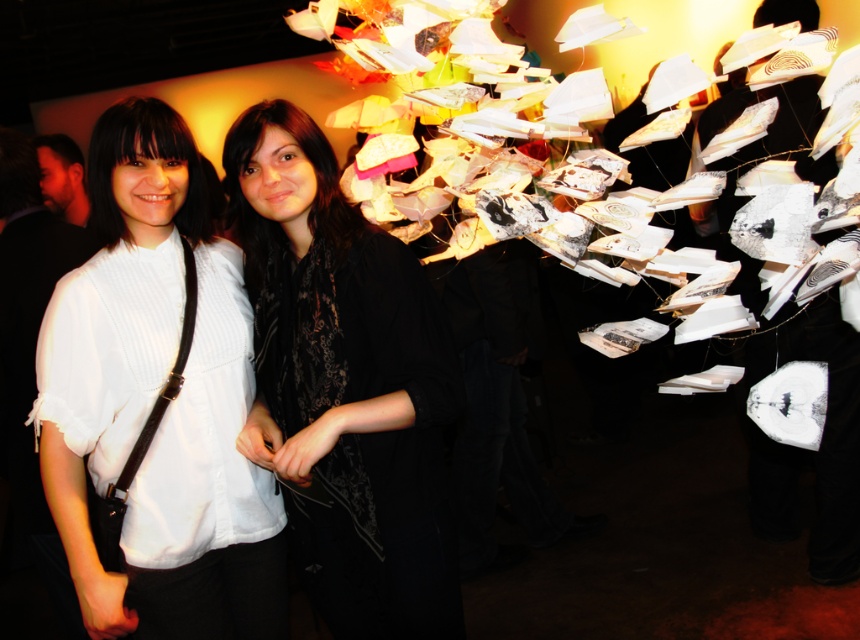
You are standing in the art exhibition and want to take a photo of the installation. The camera you have can focus on objects up to 5 feet away. Is the point at coordinates point (59, 353) within the camera focus range?

The point at coordinates point (59, 353) is 4.55 feet away from the viewer, which is within the camera focus range of up to 5 feet. Therefore, the camera can focus on it.

You are a photographer trying to capture a clear shot of both the white matte shirt at center and the black lace scarf at center. Since you want both subjects in focus, you need to know which one is taller. Can you determine which object is taller?

The white matte shirt at center is taller than the black lace scarf at center, so you should adjust your camera focus to accommodate the height difference to ensure both are in focus.

You are a photographer trying to capture a clear shot of the black lace scarf at center without the white matte shirt at center blocking it. Based on their positions, is it possible to adjust your angle to achieve this?

The white matte shirt at center is to the left of the black lace scarf at center, so by moving to the right side, you can position yourself where the white matte shirt at center is no longer in front of the black lace scarf at center, allowing for an unobstructed view.